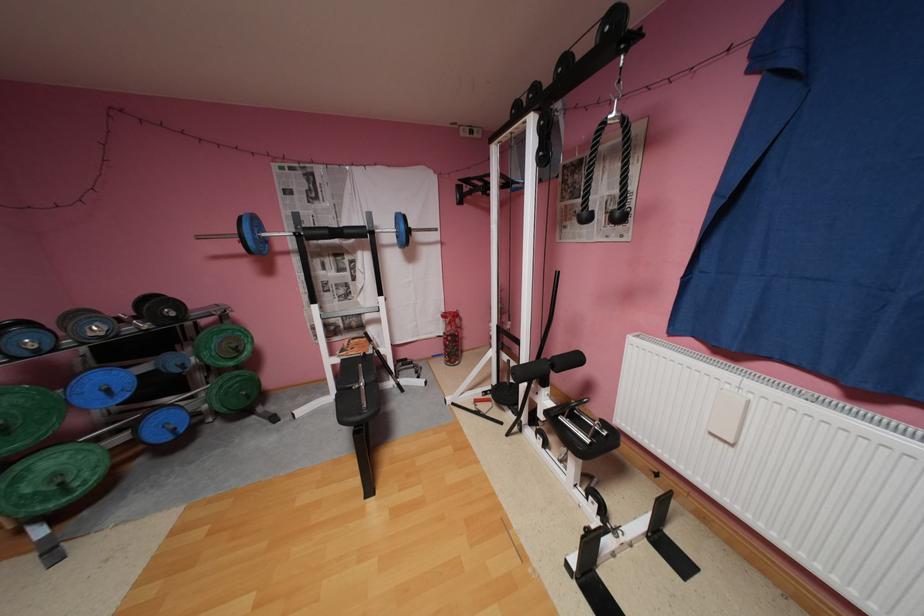
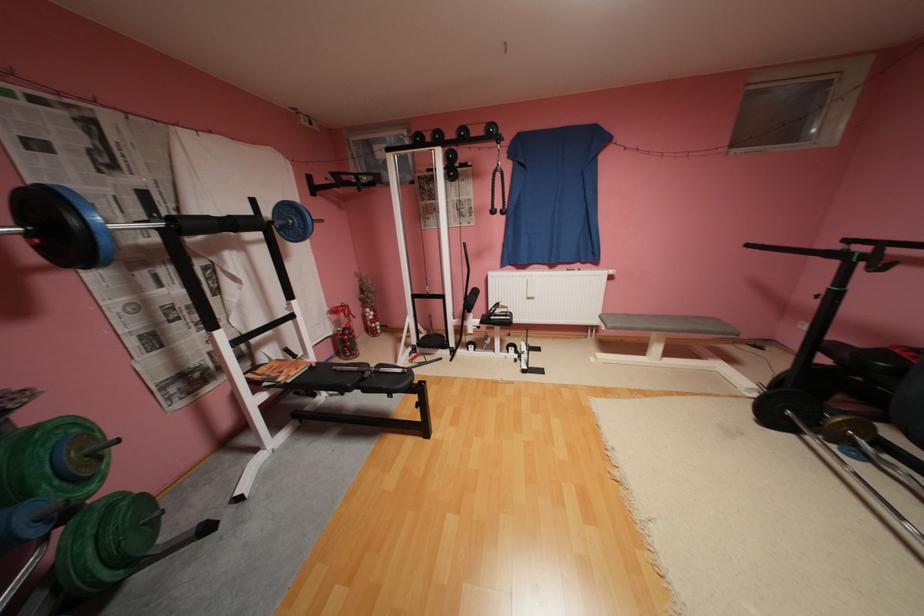
Where in the second image is the point corresponding to (594,217) from the first image?

(502, 212)